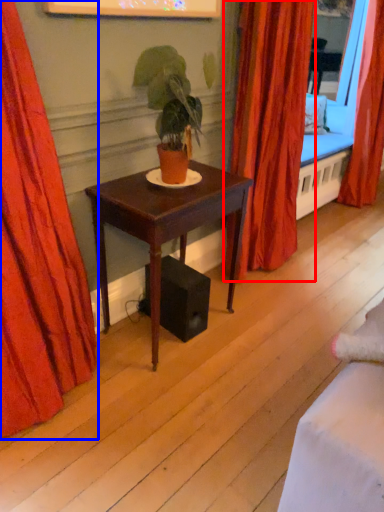
Question: Which object appears farthest to the camera in this image, curtain (highlighted by a red box) or curtain (highlighted by a blue box)?

Choices:
 (A) curtain
 (B) curtain

Answer: (A)